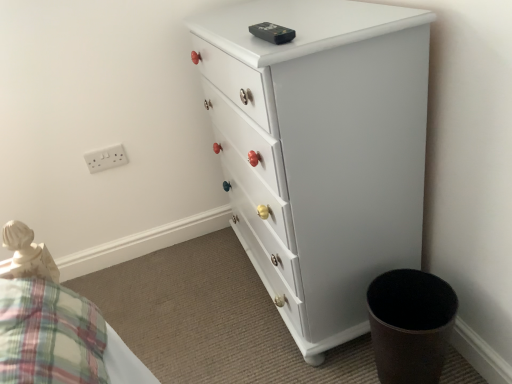
Question: Considering the positions of white painted wood chest of drawers at center and white plastic outlet at upper left in the image, is white painted wood chest of drawers at center taller or shorter than white plastic outlet at upper left?

Choices:
 (A) tall
 (B) short

Answer: (A)

Question: Based on their positions, is white painted wood chest of drawers at center located to the left or right of white plastic outlet at upper left?

Choices:
 (A) left
 (B) right

Answer: (B)

Question: Is white painted wood chest of drawers at center spatially inside white plastic outlet at upper left, or outside of it?

Choices:
 (A) inside
 (B) outside

Answer: (B)

Question: Is white plastic outlet at upper left wider or thinner than white painted wood chest of drawers at center?

Choices:
 (A) thin
 (B) wide

Answer: (A)

Question: Looking at the image, does white plastic outlet at upper left seem bigger or smaller compared to white painted wood chest of drawers at center?

Choices:
 (A) small
 (B) big

Answer: (A)

Question: Considering the positions of point (112, 158) and point (345, 170), is point (112, 158) closer or farther from the camera than point (345, 170)?

Choices:
 (A) farther
 (B) closer

Answer: (A)

Question: From a real-world perspective, is white plastic outlet at upper left above or below white painted wood chest of drawers at center?

Choices:
 (A) below
 (B) above

Answer: (B)